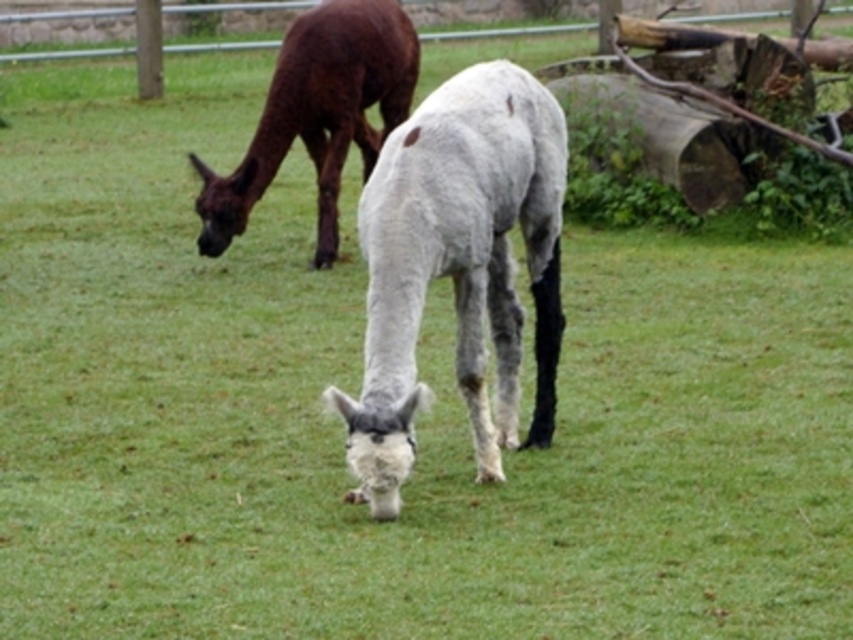
Can you confirm if white woolen alpaca at center is shorter than brown woolen alpaca at upper left?

No, white woolen alpaca at center is not shorter than brown woolen alpaca at upper left.

Who is positioned more to the left, white woolen alpaca at center or brown woolen alpaca at upper left?

brown woolen alpaca at upper left

Identify the location of white woolen alpaca at center. (457, 268).